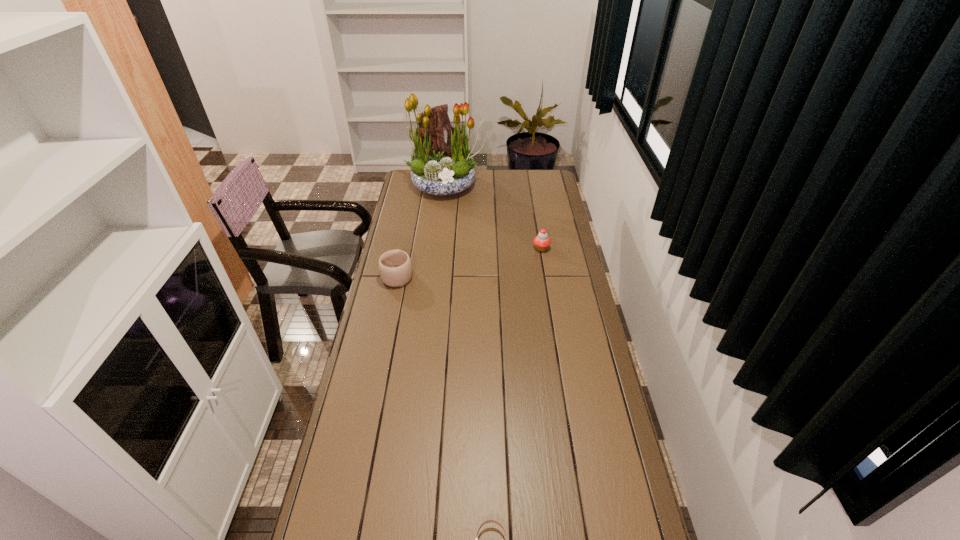
Identify the location of vacant space that's between the cupcake and the second nearest object. This screenshot has height=540, width=960. (469, 262).

Locate an element on the screen. free space between the mug and the third nearest object is located at coordinates (469, 262).

This screenshot has width=960, height=540. I want to click on free space between the flower arrangement and the mug, so click(x=421, y=231).

Find the location of a particular element. free space between the cupcake and the tallest object is located at coordinates (493, 217).

Image resolution: width=960 pixels, height=540 pixels. Identify the location of unoccupied position between the farthest object and the second farthest object. (493, 217).

Find the location of a particular element. The height and width of the screenshot is (540, 960). object that stands as the third closest to the watch is located at coordinates (438, 167).

Locate an element on the screen. This screenshot has width=960, height=540. the closest object to the watch is located at coordinates (395, 267).

I want to click on vacant position in the image that satisfies the following two spatial constraints: 1. on the side of the second nearest object with the handle; 2. on the left side of the rightmost object, so click(403, 248).

Where is `vacant space that satisfies the following two spatial constraints: 1. on the side of the rightmost object with the handle; 2. on the right side of the mug`? Image resolution: width=960 pixels, height=540 pixels. vacant space that satisfies the following two spatial constraints: 1. on the side of the rightmost object with the handle; 2. on the right side of the mug is located at coordinates 403,248.

The width and height of the screenshot is (960, 540). What are the coordinates of `vacant space that satisfies the following two spatial constraints: 1. on the front-facing side of the rightmost object; 2. on the right side of the farthest object` in the screenshot? It's located at 439,248.